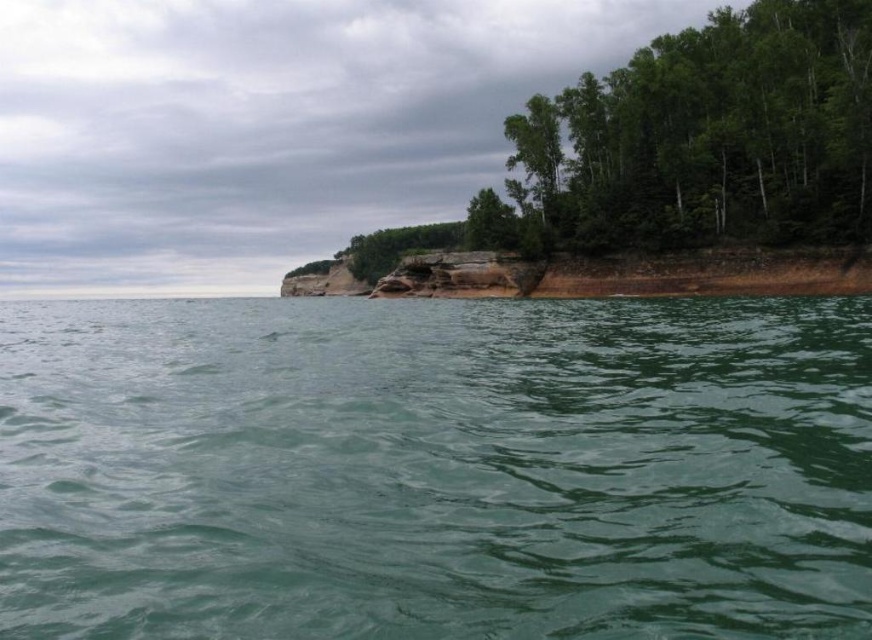
Question: Which point appears closest to the camera in this image?

Choices:
 (A) tap(570, 176)
 (B) tap(775, 609)

Answer: (B)

Question: Is green smooth water at center closer to camera compared to green leafy trees at upper right?

Choices:
 (A) yes
 (B) no

Answer: (A)

Question: Is green smooth water at center in front of green leafy trees at upper right?

Choices:
 (A) no
 (B) yes

Answer: (B)

Question: Which of the following is the closest to the observer?

Choices:
 (A) (621, 72)
 (B) (362, 508)

Answer: (B)

Question: Considering the relative positions of green smooth water at center and green leafy trees at upper right in the image provided, where is green smooth water at center located with respect to green leafy trees at upper right?

Choices:
 (A) left
 (B) right

Answer: (A)

Question: Which object appears farthest from the camera in this image?

Choices:
 (A) green smooth water at center
 (B) green leafy trees at upper right

Answer: (B)